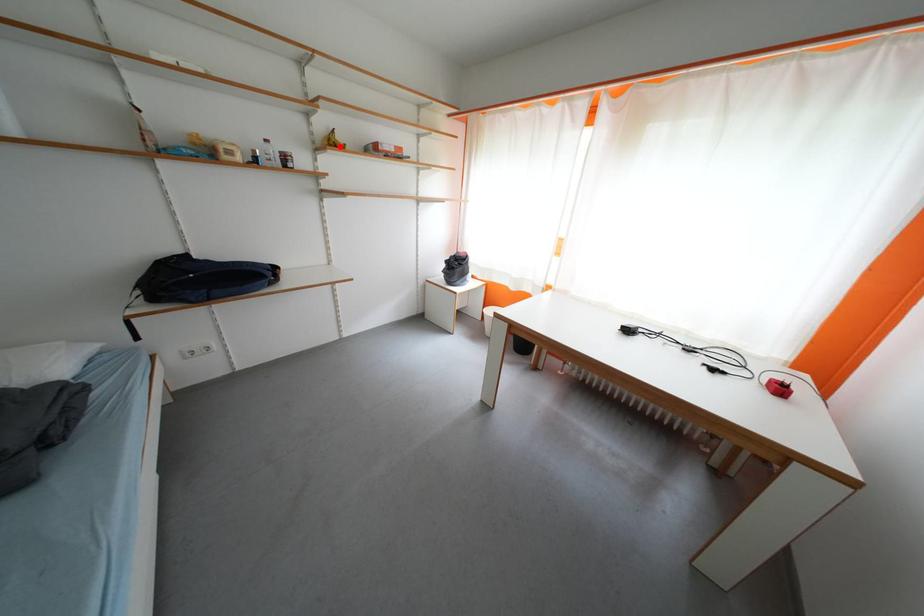
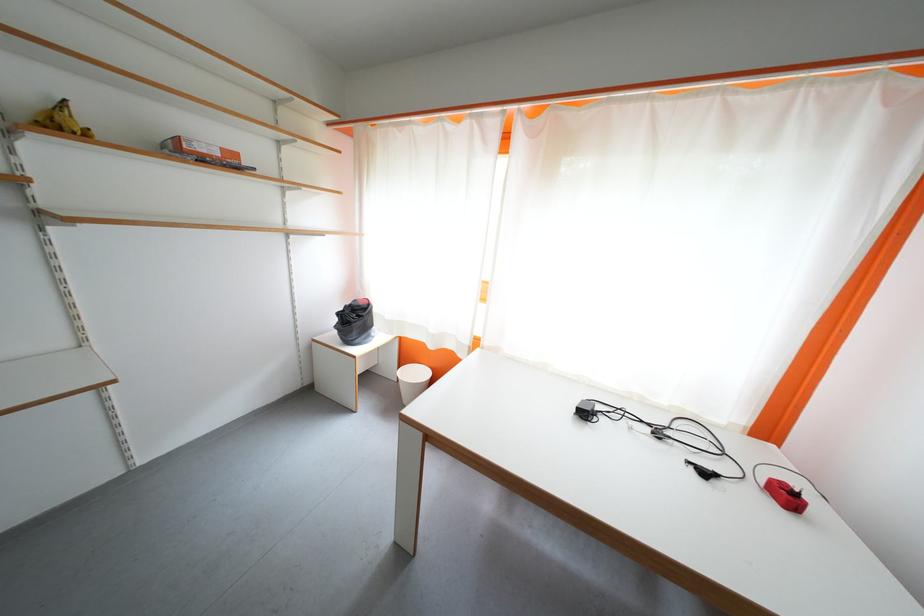
Question: I am providing you with two images of the same scene from different viewpoints. A red point is marked on the first image. Is the red point's position out of view in image 2?

Choices:
 (A) Yes
 (B) No

Answer: (B)